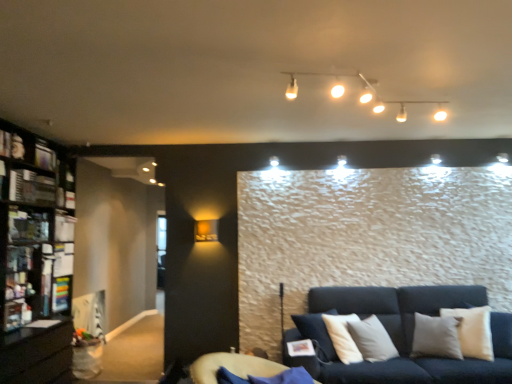
Question: Is velvet blue futon at lower center at the back of metallic silver shelf at left, the first shelf in the top-to-bottom sequence?

Choices:
 (A) yes
 (B) no

Answer: (B)

Question: Can you confirm if metallic silver shelf at left, the first shelf from the front, is positioned to the left of velvet blue futon at lower center?

Choices:
 (A) yes
 (B) no

Answer: (A)

Question: Are metallic silver shelf at left, positioned as the second shelf in bottom-to-top order, and velvet blue futon at lower center located far from each other?

Choices:
 (A) no
 (B) yes

Answer: (B)

Question: Does metallic silver shelf at left, arranged as the 2th shelf when viewed from the back, lie behind velvet blue futon at lower center?

Choices:
 (A) no
 (B) yes

Answer: (B)

Question: Does metallic silver shelf at left, positioned as the second shelf in bottom-to-top order, turn towards velvet blue futon at lower center?

Choices:
 (A) no
 (B) yes

Answer: (A)

Question: Do you think matte black shelf at left, the second shelf from the front, is within black wooden bookcase at left, or outside of it?

Choices:
 (A) inside
 (B) outside

Answer: (A)

Question: Considering the positions of point (60, 283) and point (53, 226), is point (60, 283) closer or farther from the camera than point (53, 226)?

Choices:
 (A) farther
 (B) closer

Answer: (A)

Question: From the image's perspective, is matte black shelf at left, placed as the first shelf when sorted from back to front, positioned above or below black wooden bookcase at left?

Choices:
 (A) above
 (B) below

Answer: (B)

Question: Looking at their shapes, would you say matte black shelf at left, the second shelf from the front, is wider or thinner than black wooden bookcase at left?

Choices:
 (A) thin
 (B) wide

Answer: (A)

Question: Is point (65, 292) closer or farther from the camera than point (198, 221)?

Choices:
 (A) farther
 (B) closer

Answer: (B)

Question: From the image's perspective, is matte black shelf at left, which is counted as the first shelf, starting from the bottom, located above or below matte gold wall sconce at upper left, the 2th lamp when ordered from right to left?

Choices:
 (A) below
 (B) above

Answer: (A)

Question: From their relative heights in the image, would you say matte black shelf at left, the second shelf from the front, is taller or shorter than matte gold wall sconce at upper left, which is counted as the first lamp, starting from the bottom?

Choices:
 (A) short
 (B) tall

Answer: (B)

Question: In the image, is matte black shelf at left, the second shelf from the front, on the left side or the right side of matte gold wall sconce at upper left, the 2th lamp from the top?

Choices:
 (A) right
 (B) left

Answer: (B)

Question: From the image's perspective, is white glossy track lights at upper center, marked as the first lamp in a front-to-back arrangement, positioned above or below metallic silver shelf at left, the first shelf in the top-to-bottom sequence?

Choices:
 (A) above
 (B) below

Answer: (A)

Question: Considering the positions of point (309, 74) and point (40, 175), is point (309, 74) closer or farther from the camera than point (40, 175)?

Choices:
 (A) farther
 (B) closer

Answer: (B)